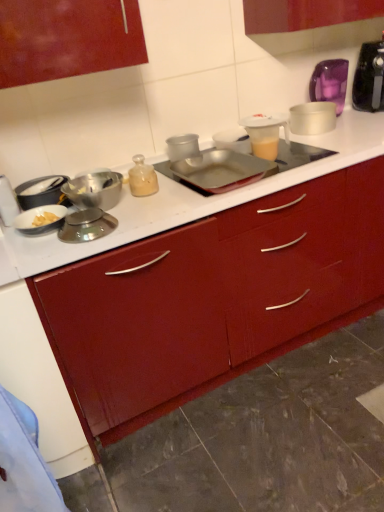
Where is `vacant space to the right of metallic silver scale at center-left, acting as the 5th kitchen appliance starting from the left`? The height and width of the screenshot is (512, 384). vacant space to the right of metallic silver scale at center-left, acting as the 5th kitchen appliance starting from the left is located at coordinates (147, 218).